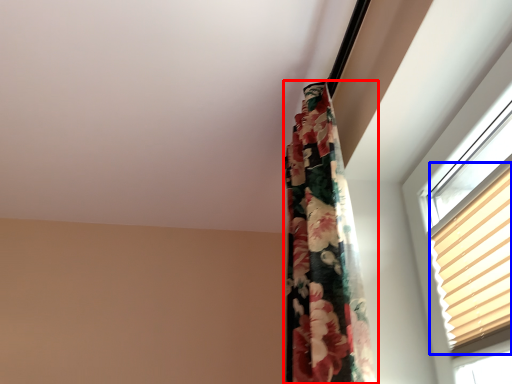
Question: Which of the following is the closest to the observer, curtain (highlighted by a red box) or blind (highlighted by a blue box)?

Choices:
 (A) curtain
 (B) blind

Answer: (B)